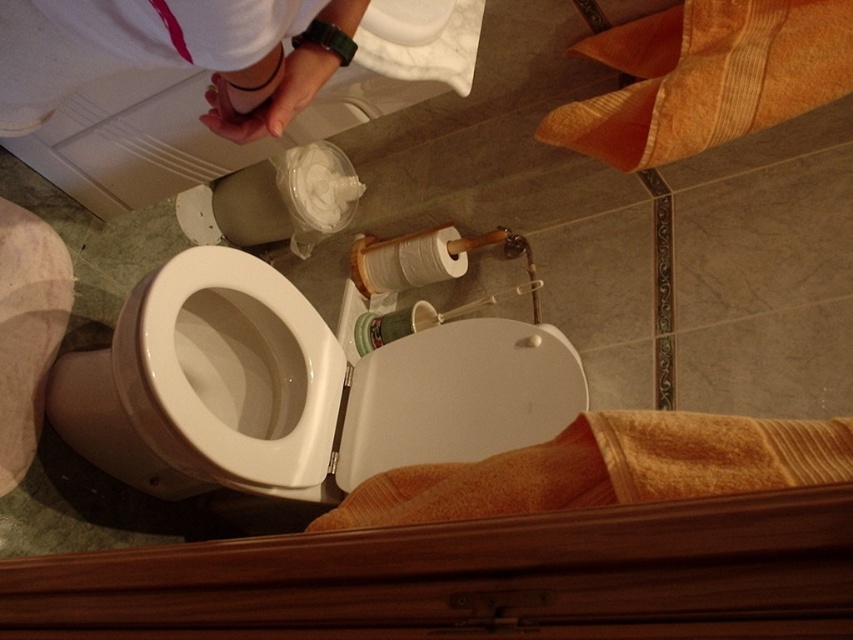
Between point (141, 470) and point (421, 406), which one is positioned in front?

Point (141, 470) is more forward.

Does white glossy toilet bowl at center have a smaller size compared to white glossy toilet lid at center?

No, white glossy toilet bowl at center is not smaller than white glossy toilet lid at center.

Image resolution: width=853 pixels, height=640 pixels. Describe the element at coordinates (294, 388) in the screenshot. I see `white glossy toilet bowl at center` at that location.

The width and height of the screenshot is (853, 640). I want to click on white glossy toilet bowl at center, so click(x=294, y=388).

Is white fabric at upper left closer to the viewer compared to white glossy toilet lid at center?

Yes, white fabric at upper left is closer to the viewer.

Is white fabric at upper left bigger than white glossy toilet lid at center?

Yes.

Who is more forward, (144, 42) or (383, 412)?

Point (144, 42)

I want to click on white fabric at upper left, so click(169, 52).

Which is below, white fabric at upper left or white matte toilet paper at center?

Positioned lower is white matte toilet paper at center.

Does white fabric at upper left have a smaller size compared to white matte toilet paper at center?

No.

Is point (206, 115) positioned in front of point (393, 278)?

Yes.

Where is `white fabric at upper left`? This screenshot has width=853, height=640. white fabric at upper left is located at coordinates (169, 52).